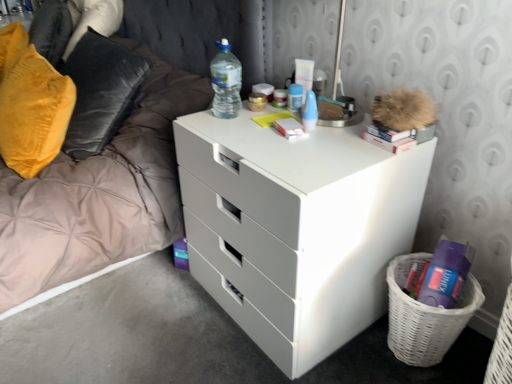
Identify the location of vacant space behind white matte book at center, which ranks as the 1th book in left-to-right order. This screenshot has width=512, height=384. (273, 114).